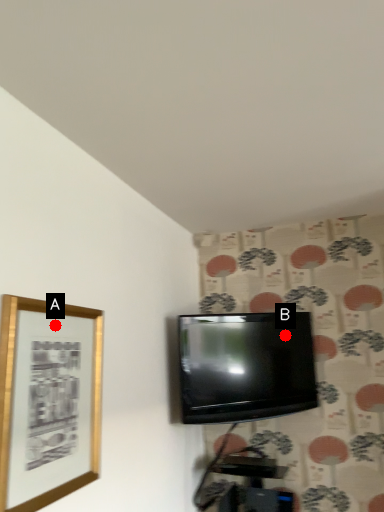
Question: Two points are circled on the image, labeled by A and B beside each circle. Which point is closer to the camera taking this photo?

Choices:
 (A) A is closer
 (B) B is closer

Answer: (A)